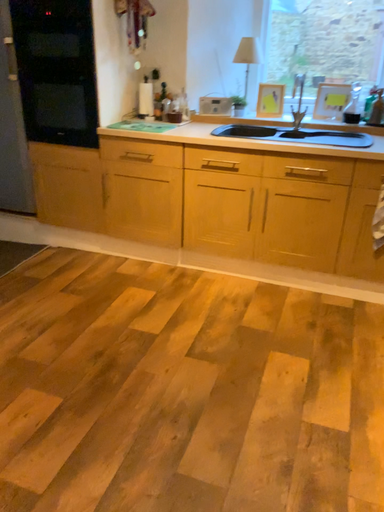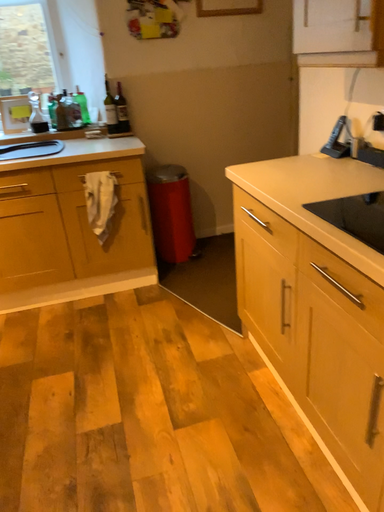
Question: How did the camera likely rotate when shooting the video?

Choices:
 (A) rotated upward
 (B) rotated downward

Answer: (A)